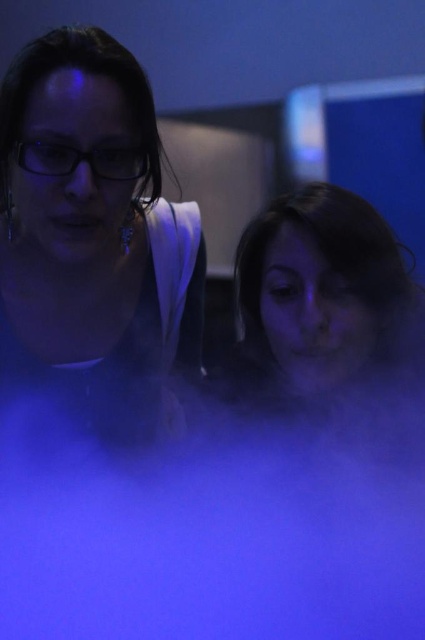
You are a photographer trying to capture a clear shot of the two people in the foggy scene. The focus point of your camera is currently set at point (108, 438). Based on the scene description, will this point ensure both individuals are in focus?

The point (108, 438) is 35.87 inches from the camera. Since the two people are standing close together, it is likely that both will be in focus if the focus point is set at this distance. However, the dense fog may affect the clarity of the image despite proper focus.

Based on the scene description, can you determine if the matte black hair at left is wider than the matte skin at center?

The matte black hair at left might be wider than matte skin at center according to the description.